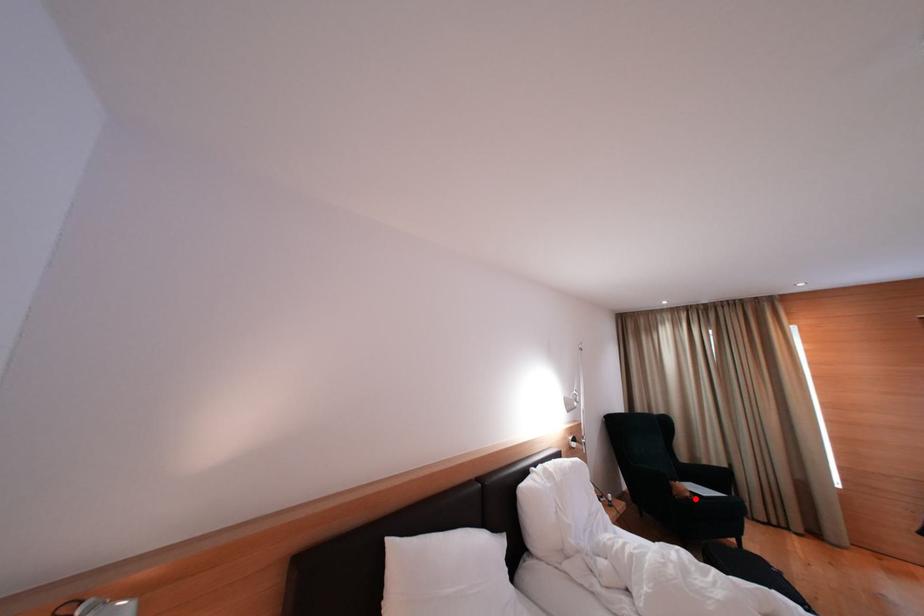
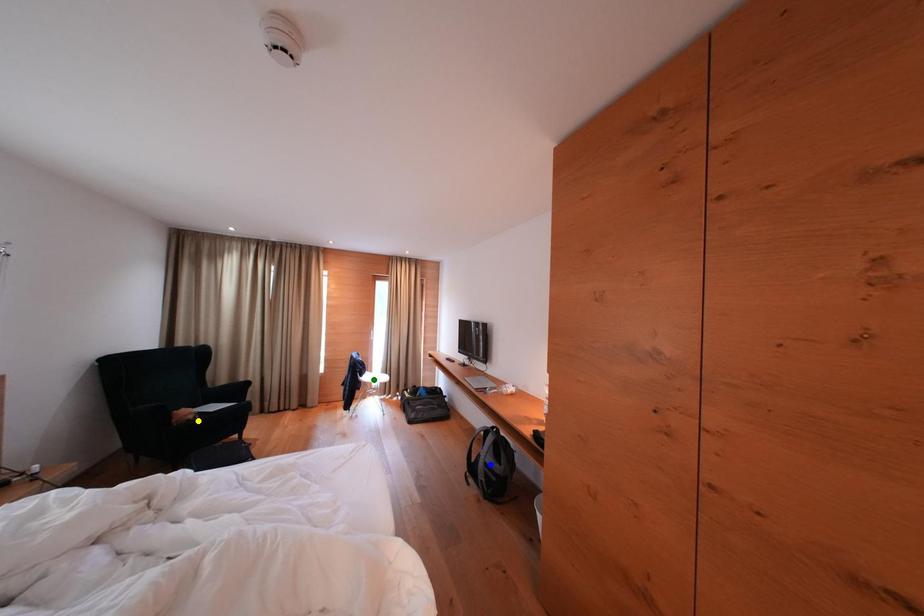
Question: I am providing you with two images of the same scene from different viewpoints. A red point is marked on the first image. You are given multiple points on the second image. Which spot in image 2 lines up with the point in image 1?

Choices:
 (A) blue point
 (B) yellow point
 (C) green point

Answer: (B)